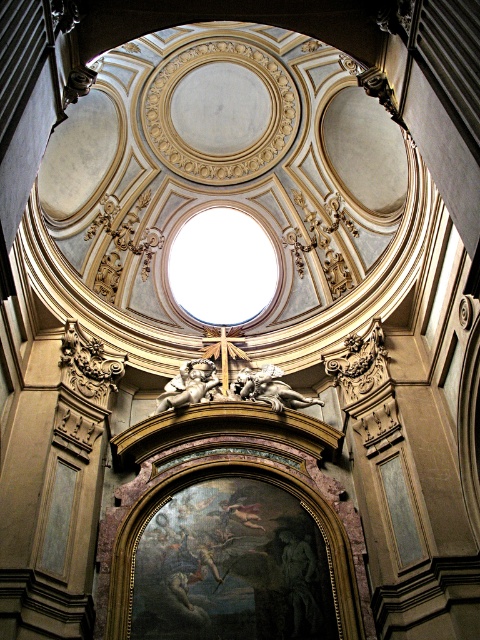
Is sculpted gold cherub at center above golden metallic cherub at center?

No, sculpted gold cherub at center is not above golden metallic cherub at center.

Find the location of `sculpted gold cherub at center`. sculpted gold cherub at center is located at coordinates (269, 388).